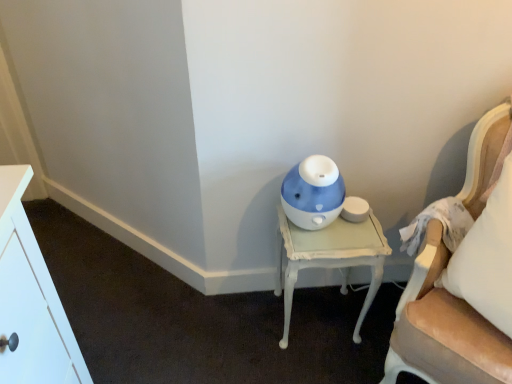
Question: Is white painted wood nightstand at lower right shorter than velvet beige chair at right?

Choices:
 (A) yes
 (B) no

Answer: (A)

Question: Is white painted wood nightstand at lower right surrounding velvet beige chair at right?

Choices:
 (A) no
 (B) yes

Answer: (A)

Question: From the image's perspective, does white painted wood nightstand at lower right appear lower than velvet beige chair at right?

Choices:
 (A) no
 (B) yes

Answer: (B)

Question: From a real-world perspective, is white painted wood nightstand at lower right below velvet beige chair at right?

Choices:
 (A) no
 (B) yes

Answer: (B)

Question: Would you say white painted wood nightstand at lower right is outside velvet beige chair at right?

Choices:
 (A) yes
 (B) no

Answer: (A)

Question: Does white painted wood nightstand at lower right have a greater width compared to velvet beige chair at right?

Choices:
 (A) no
 (B) yes

Answer: (A)

Question: Does blue glossy humidifier at center have a greater width compared to velvet beige chair at right?

Choices:
 (A) no
 (B) yes

Answer: (A)

Question: Can you confirm if blue glossy humidifier at center is smaller than velvet beige chair at right?

Choices:
 (A) yes
 (B) no

Answer: (A)

Question: Is blue glossy humidifier at center further to the viewer compared to velvet beige chair at right?

Choices:
 (A) yes
 (B) no

Answer: (A)

Question: Does blue glossy humidifier at center have a larger size compared to velvet beige chair at right?

Choices:
 (A) no
 (B) yes

Answer: (A)

Question: From a real-world perspective, is blue glossy humidifier at center physically below velvet beige chair at right?

Choices:
 (A) no
 (B) yes

Answer: (B)

Question: Is blue glossy humidifier at center at the left side of velvet beige chair at right?

Choices:
 (A) yes
 (B) no

Answer: (A)

Question: Is the position of blue glossy humidifier at center less distant than that of white painted wood nightstand at lower right?

Choices:
 (A) no
 (B) yes

Answer: (B)